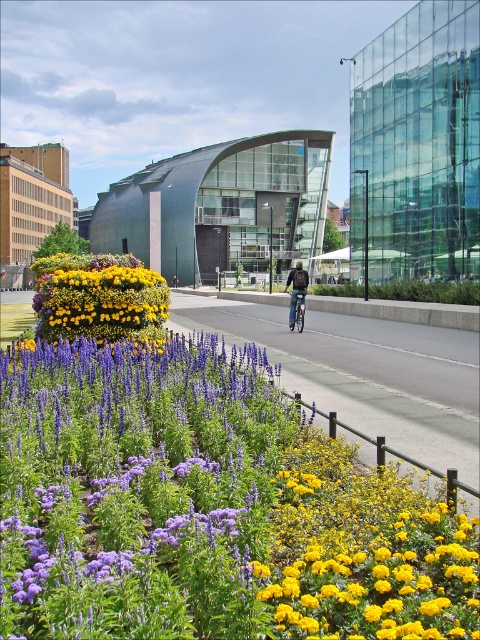
You are standing at the origin point in the urban scene. You need to place a small bench exactly at the coordinates given for the dark blue jeans at center. Will the bench be positioned near the flower bed or the pathway?

The dark blue jeans at center is located at point (297, 289). Since the flower bed is in the foreground and the pathway is in the middle ground, the coordinates suggest the bench would be placed near the pathway where the cyclist is riding.

You are a pedestrian standing on the pathway and see the dark blue jeans at center and the metallic silver bicycle at center. Which object is taller?

The dark blue jeans at center is taller than the metallic silver bicycle at center.

You are standing at the point labeled point (120, 273) and want to walk to the point labeled point (307, 278). Which direction should you face to move towards your destination?

You should face towards the upper direction because point (307, 278) is further away from the viewer compared to point (120, 273).